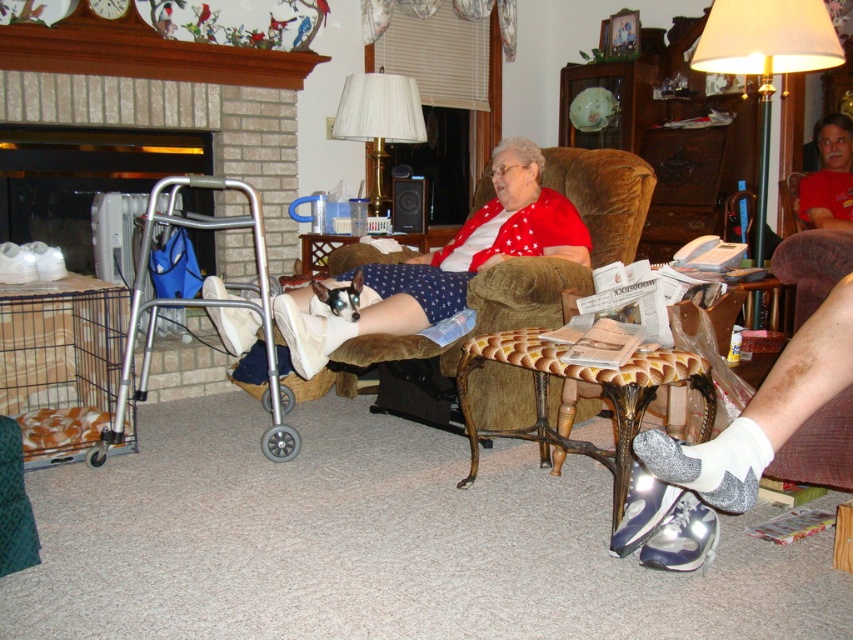
Based on the scene, can you determine if the velvet brown armchair at center is wider than the white fabric lampshade at upper center?

The velvet brown armchair at center is wider than the white fabric lampshade at upper center according to the description.

You are a photographer setting up a shot in the living room. You need to place a small prop between the velvet brown armchair at center and the white fabric lampshade at upper center. Based on their positions, where should you position the prop so it is equidistant from both objects?

The velvet brown armchair at center is closer to the viewer than the white fabric lampshade at upper center. To place the prop equidistant between them, position it closer to the lampshade since the armchair is nearer, balancing the distance between both objects.

You are organizing a living room and want to place a new coffee table between the velvet brown armchair at center and the printed paper magazine at center. Based on their current positions, which side of the magazine should the coffee table be placed on to align with the existing arrangement?

The velvet brown armchair at center is positioned on the left side of printed paper magazine at center, so the coffee table should be placed to the left of the magazine to maintain alignment with the existing arrangement.